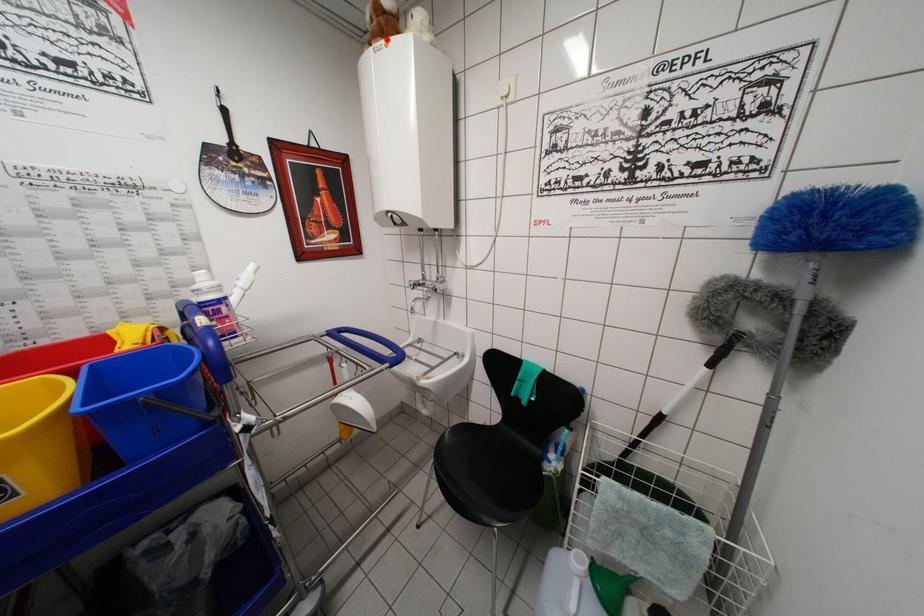
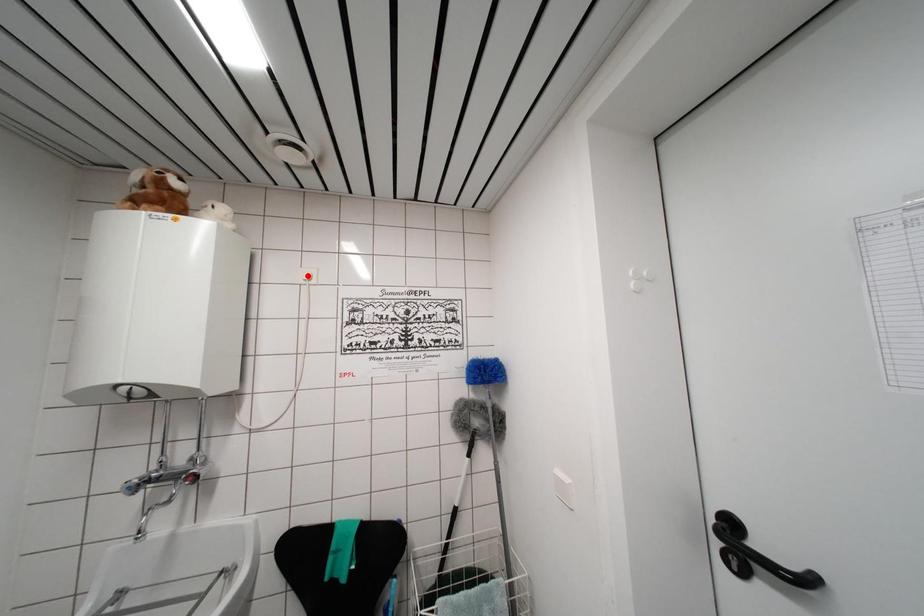
Looking at this image, I am providing you with two images of the same scene from different viewpoints. A red point is marked on the first image and another point is marked on the second image. Are the points marked in image1 and image2 representing the same 3D position?

No